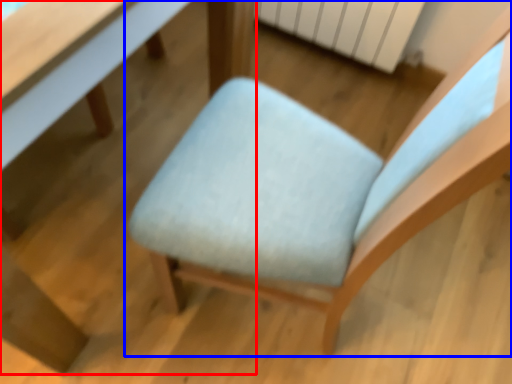
Question: Among these objects, which one is nearest to the camera, table (highlighted by a red box) or chair (highlighted by a blue box)?

Choices:
 (A) table
 (B) chair

Answer: (B)